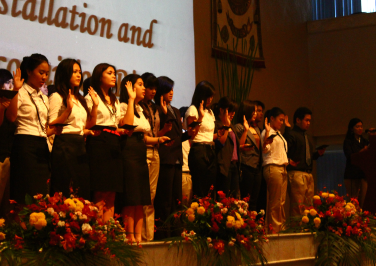
The width and height of the screenshot is (376, 266). In order to click on brown wall in this screenshot , I will do `click(333, 71)`, `click(276, 49)`.